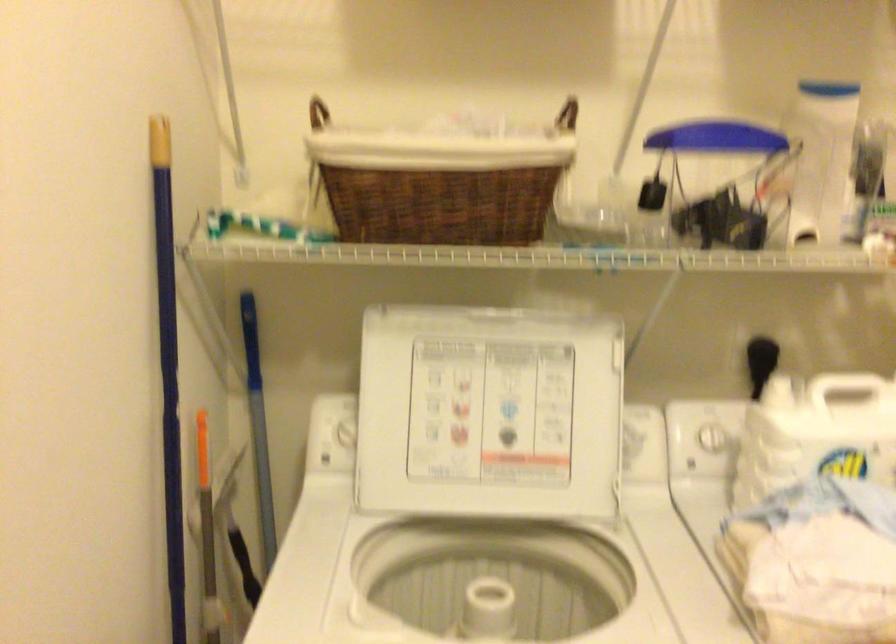
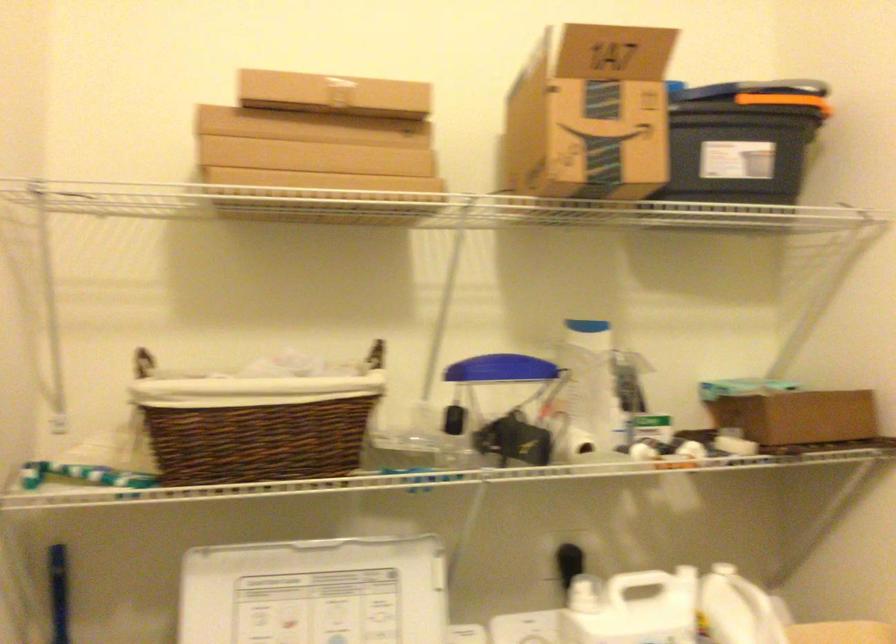
Question: The first image is from the beginning of the video and the second image is from the end. How did the camera likely rotate when shooting the video?

Choices:
 (A) Left
 (B) Right
 (C) Up
 (D) Down

Answer: (C)